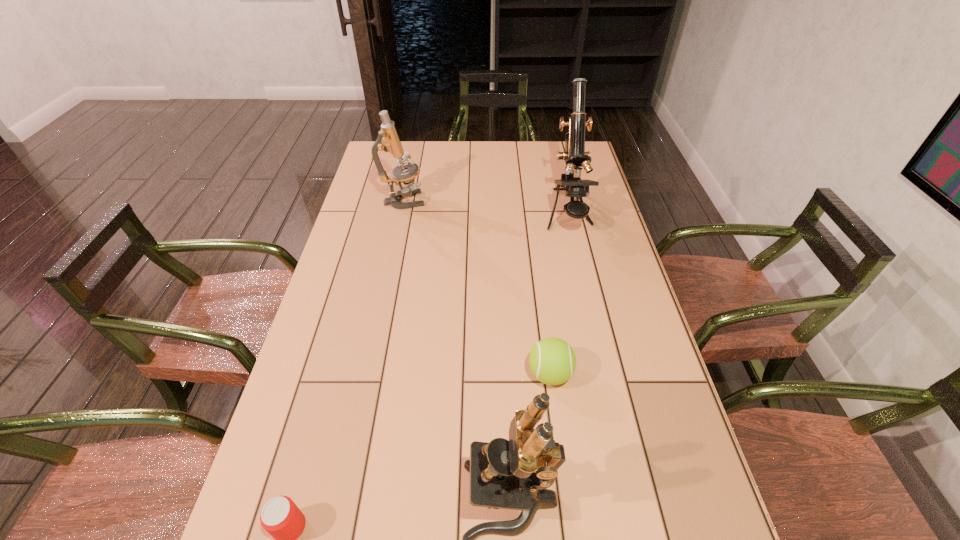
You are a GUI agent. You are given a task and a screenshot of the screen. Output one action in this format:
    pyautogui.click(x=<x>, y=<y>)
    Task: Click on the tallest object
    The image size is (960, 540).
    Given the screenshot: What is the action you would take?
    pyautogui.click(x=575, y=156)

At what (x,y) coordinates should I click in order to perform the action: click on the tallest microscope. Please return your answer as a coordinate pair (x, y). The image size is (960, 540). Looking at the image, I should click on (575, 156).

At what (x,y) coordinates should I click in order to perform the action: click on the leftmost microscope. Please return your answer as a coordinate pair (x, y). The width and height of the screenshot is (960, 540). Looking at the image, I should click on (388, 140).

Identify the location of the third farthest object. This screenshot has height=540, width=960. (552, 361).

The image size is (960, 540). What are the coordinates of `tennis ball` in the screenshot? It's located at (552, 361).

Locate an element on the screen. Image resolution: width=960 pixels, height=540 pixels. blank space located 0.140m through the eyepiece of the tallest object is located at coordinates (581, 274).

I want to click on free space located on the front of the leftmost microscope, so click(x=394, y=247).

I want to click on vacant region located 0.150m on the front of the tennis ball, so click(x=561, y=459).

Where is `object located at the left edge`? object located at the left edge is located at coordinates pos(388,140).

At what (x,y) coordinates should I click in order to perform the action: click on object located in the right edge section of the desktop. Please return your answer as a coordinate pair (x, y). Looking at the image, I should click on (575, 156).